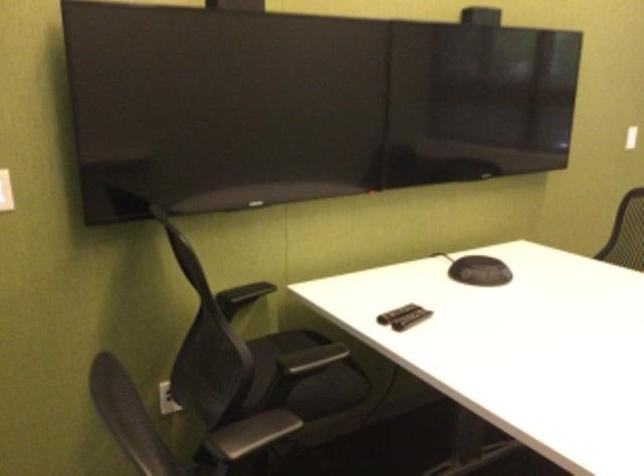
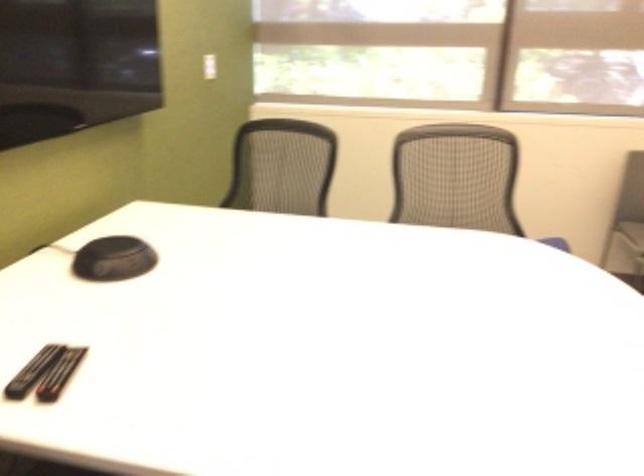
Question: The camera is either moving clockwise (left) or counter-clockwise (right) around the object. The first image is from the beginning of the video and the second image is from the end. Is the camera moving left or right when shooting the video?

Choices:
 (A) Left
 (B) Right

Answer: (A)